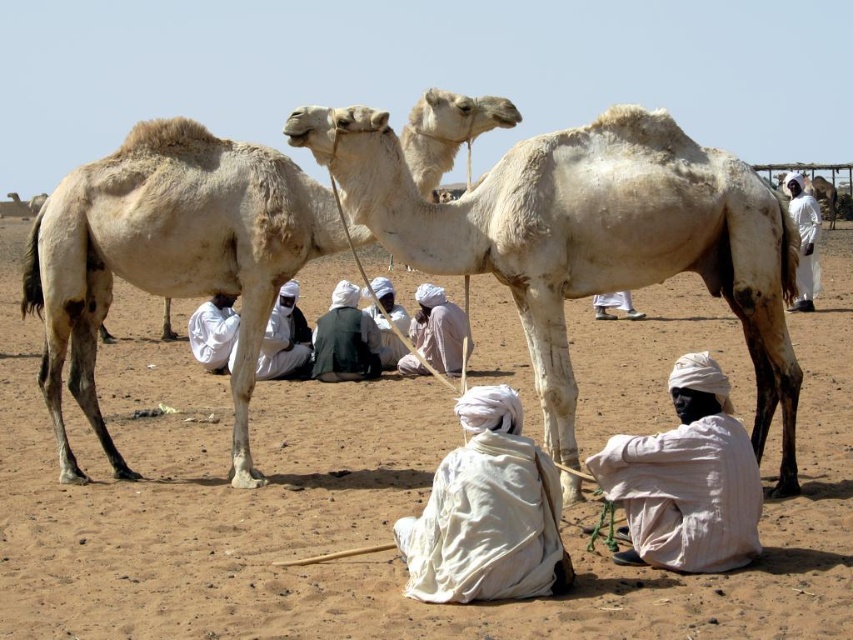
Question: Can you confirm if white cloth turban at center is positioned to the left of white fabric turban at lower center?

Choices:
 (A) no
 (B) yes

Answer: (B)

Question: Considering the relative positions of white cloth at right and white fabric turban at lower center in the image provided, where is white cloth at right located with respect to white fabric turban at lower center?

Choices:
 (A) left
 (B) right

Answer: (B)

Question: Can you confirm if white cloth at lower right is wider than white cloth turban at center?

Choices:
 (A) no
 (B) yes

Answer: (B)

Question: Considering the real-world distances, which object is farthest from the white cloth at right?

Choices:
 (A) white fabric turban at lower center
 (B) white cloth at center

Answer: (B)

Question: Which object is closer to the camera taking this photo?

Choices:
 (A) white cloth at right
 (B) white cloth at lower right
 (C) dark green fabric at center
 (D) light beige fabric turban at center

Answer: (B)

Question: Which of these objects is positioned farthest from the white cloth at lower right?

Choices:
 (A) white cloth at center
 (B) white cloth at right
 (C) brown sandy dirt at center
 (D) white fabric turban at lower center

Answer: (D)